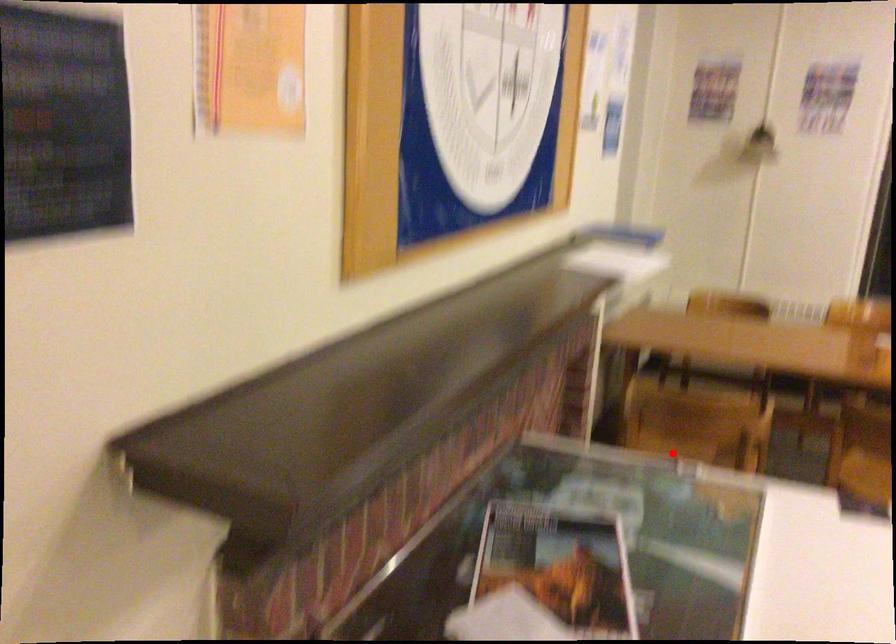
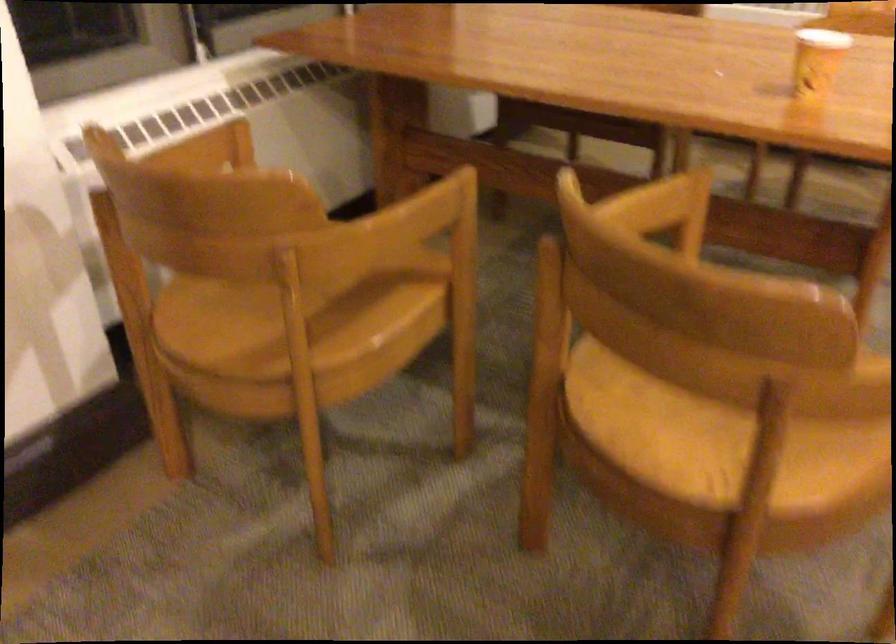
Question: I am providing you with two images of the same scene from different viewpoints. Given a red point in image1, look at the same physical point in image2. Is it:

Choices:
 (A) Closer to the viewpoint
 (B) Farther from the viewpoint

Answer: (A)